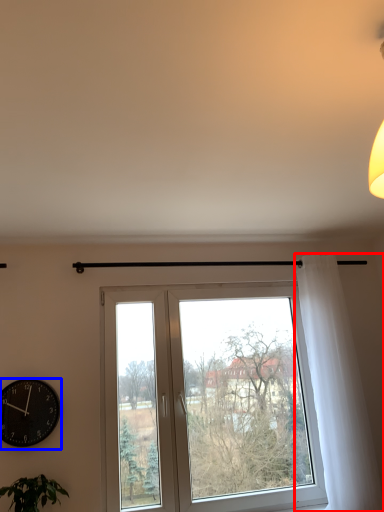
Question: Which of the following is the farthest to the observer, curtain (highlighted by a red box) or wall clock (highlighted by a blue box)?

Choices:
 (A) curtain
 (B) wall clock

Answer: (A)